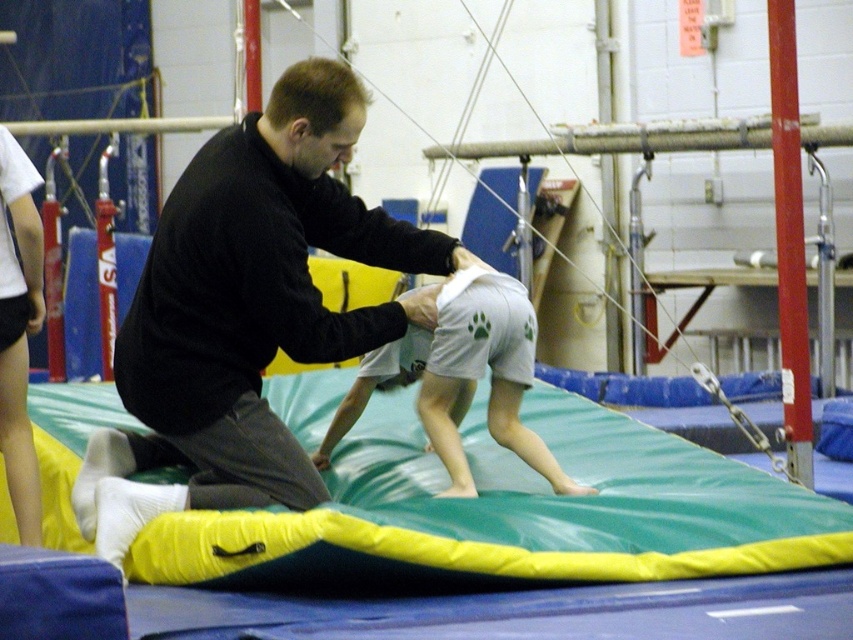
You are a gymnastics instructor standing at the entrance of the training facility. You need to quickly reach the green foam mat at center to assist a child. Considering your average walking speed is 1.5 meters per second, how many seconds will it take you to reach the mat?

The distance between the green foam mat at center and the viewer is 6.27 meters. At a walking speed of 1.5 meters per second, it would take approximately 4.18 seconds to reach the mat.

You are a gymnast standing at point (x=486, y=330) and want to move to point (x=751, y=468). Since both points are in the training area, will you have to move forward or backward to reach your destination?

Point (x=751, y=468) is further to the camera than point (x=486, y=330), so you will have to move forward to reach it.

You are a gymnastics coach observing a training session. You notice the black matte shirt at center and the white cotton shorts at center. Which clothing item is higher in position compared to the other?

The black matte shirt at center is taller than the white cotton shorts at center, so the black matte shirt at center is higher in position.